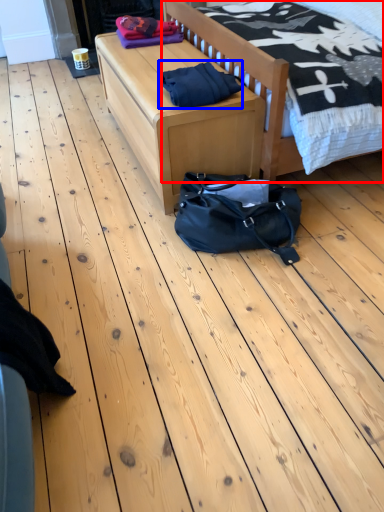
Question: Which object is further to the camera taking this photo, bed (highlighted by a red box) or material (highlighted by a blue box)?

Choices:
 (A) bed
 (B) material

Answer: (B)